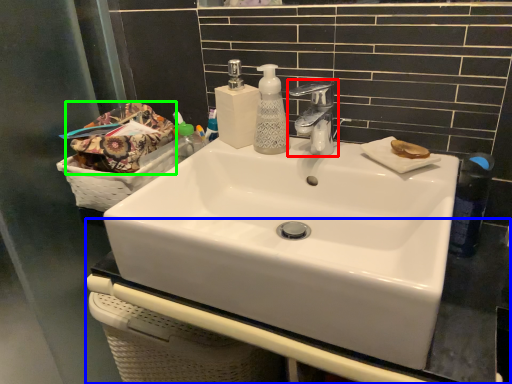
Question: Which object is positioned farthest from tap (highlighted by a red box)? Select from counter top (highlighted by a blue box) and material (highlighted by a green box).

Choices:
 (A) counter top
 (B) material

Answer: (A)